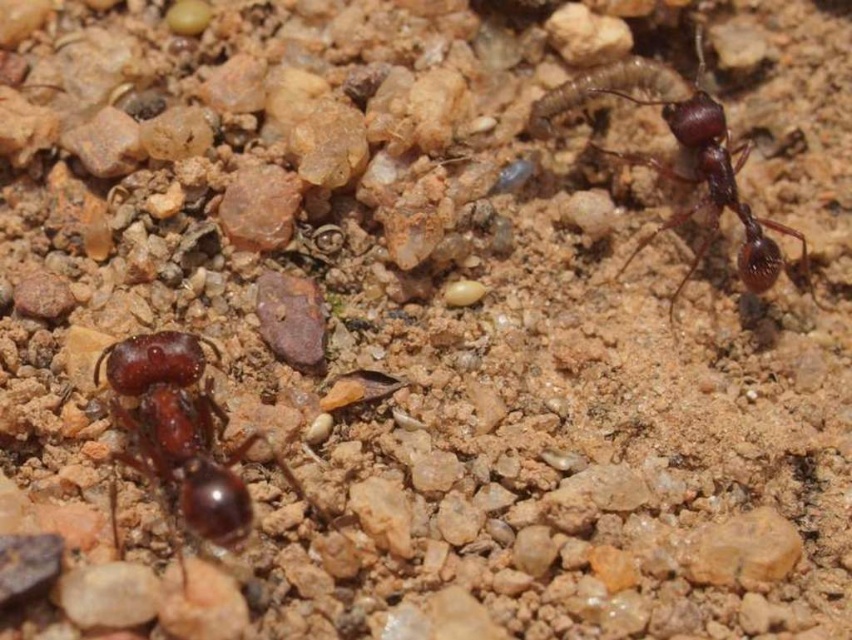
You are an entomologist observing two ants on a rocky surface. You notice a shiny dark brown ant at lower left and another ant. Which ant is located at the coordinates point [181,435]?

The shiny dark brown ant at lower left is located at the coordinates point [181,435].

In the scene shown: You are an entomologist observing two ants in a rocky environment. You notice the shiny dark brown ant at lower left and the shiny dark brown ant at upper right. Which ant is larger in size?

The shiny dark brown ant at upper right is larger than the shiny dark brown ant at lower left.

You are an entomologist observing two ants in a rocky environment. You notice the shiny dark brown ant at lower left and the shiny dark brown ant at upper right. Which ant has a smaller height?

The shiny dark brown ant at lower left has a lesser height compared to the shiny dark brown ant at upper right.